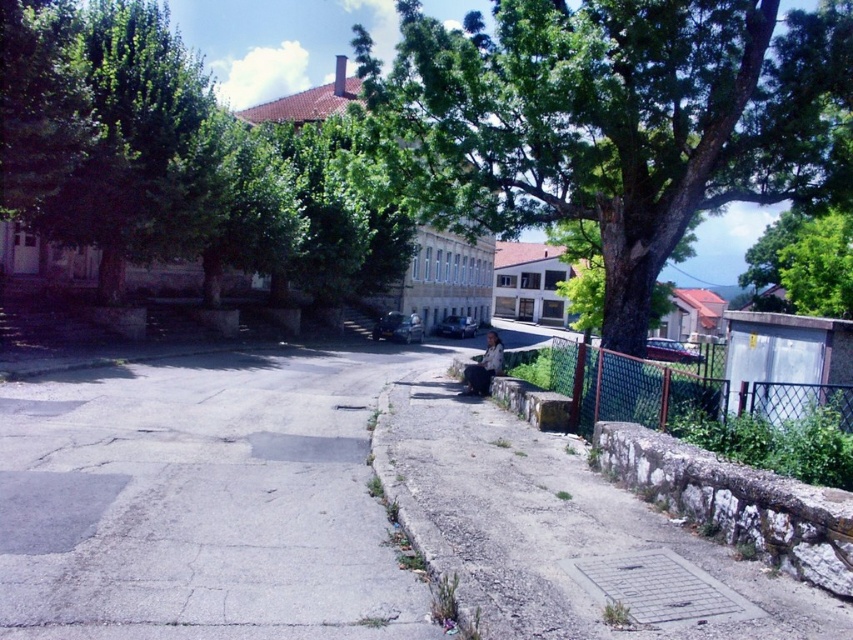
Does gray concrete pavement at center appear under green leafy tree at center?

Correct, gray concrete pavement at center is located below green leafy tree at center.

Is point (125, 568) more distant than point (785, 58)?

No, it is in front of (785, 58).

Locate an element on the screen. gray concrete pavement at center is located at coordinates (202, 502).

Which is below, green leafy tree at center or green mesh fence at lower right?

green mesh fence at lower right is lower down.

Is point (837, 19) positioned after point (834, 394)?

Yes, it is.

What do you see at coordinates (612, 122) in the screenshot? I see `green leafy tree at center` at bounding box center [612, 122].

You are a GUI agent. You are given a task and a screenshot of the screen. Output one action in this format:
    pyautogui.click(x=<x>, y=<y>)
    Task: Click on the green leafy tree at center
    The image size is (853, 640).
    Given the screenshot: What is the action you would take?
    pyautogui.click(x=612, y=122)

Can you confirm if gray concrete pavement at center is positioned to the left of green mesh fence at lower right?

Indeed, gray concrete pavement at center is positioned on the left side of green mesh fence at lower right.

What do you see at coordinates (202, 502) in the screenshot? I see `gray concrete pavement at center` at bounding box center [202, 502].

At what (x,y) coordinates should I click in order to perform the action: click on gray concrete pavement at center. Please return your answer as a coordinate pair (x, y). This screenshot has width=853, height=640. Looking at the image, I should click on (202, 502).